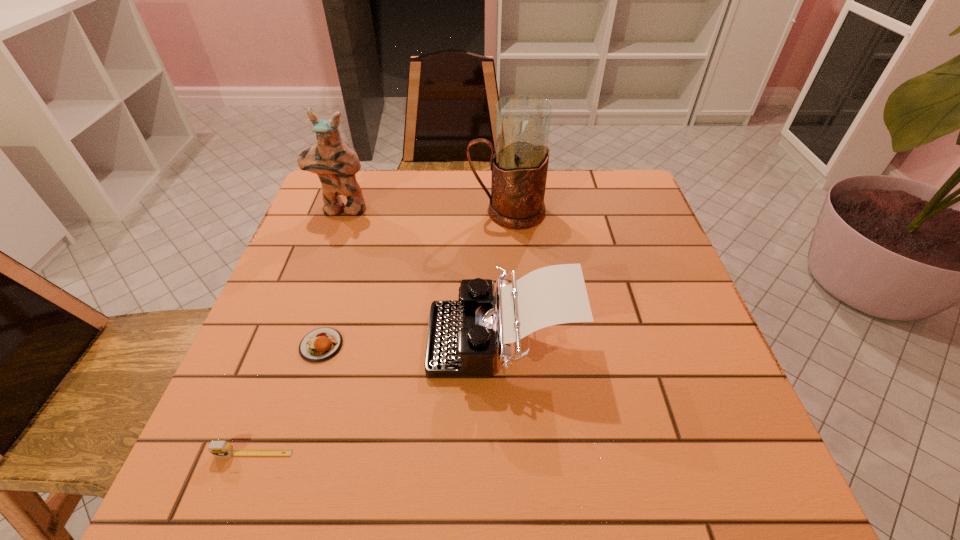
You are a GUI agent. You are given a task and a screenshot of the screen. Output one action in this format:
    pyautogui.click(x=<x>, y=<y>)
    Task: Click on the object that is the second closest to the nearest object
    This screenshot has width=960, height=540.
    Given the screenshot: What is the action you would take?
    click(462, 335)

Find the location of a particular element. This screenshot has height=540, width=960. free space that satisfies the following two spatial constraints: 1. on the keys of the third shortest object; 2. on the front side of the patty (food) is located at coordinates [x=502, y=345].

Where is `vacant position in the image that satisfies the following two spatial constraints: 1. with the handle on the side of the pitcher; 2. at the front of the nearest object with the tape extended`? Image resolution: width=960 pixels, height=540 pixels. vacant position in the image that satisfies the following two spatial constraints: 1. with the handle on the side of the pitcher; 2. at the front of the nearest object with the tape extended is located at coordinates (524, 453).

Locate an element on the screen. Image resolution: width=960 pixels, height=540 pixels. free space that satisfies the following two spatial constraints: 1. on the keys of the third tallest object; 2. at the front of the tape measure with the tape extended is located at coordinates (506, 453).

Find the location of a particular element. Image resolution: width=960 pixels, height=540 pixels. blank space that satisfies the following two spatial constraints: 1. with the handle on the side of the pitcher; 2. at the front of the fourth tallest object with the tape extended is located at coordinates (524, 453).

Find the location of a particular element. The image size is (960, 540). vacant space that satisfies the following two spatial constraints: 1. with the handle on the side of the pitcher; 2. on the front side of the patty (food) is located at coordinates (516, 345).

The width and height of the screenshot is (960, 540). Find the location of `blank space that satisfies the following two spatial constraints: 1. with the handle on the side of the pitcher; 2. at the front of the tape measure with the tape extended`. blank space that satisfies the following two spatial constraints: 1. with the handle on the side of the pitcher; 2. at the front of the tape measure with the tape extended is located at coordinates (524, 453).